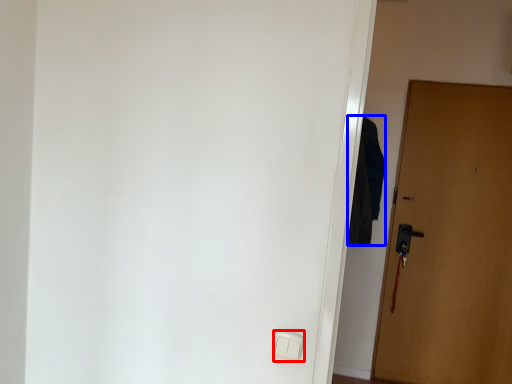
Question: Which object appears closest to the camera in this image, light switch (highlighted by a red box) or robe (highlighted by a blue box)?

Choices:
 (A) light switch
 (B) robe

Answer: (A)